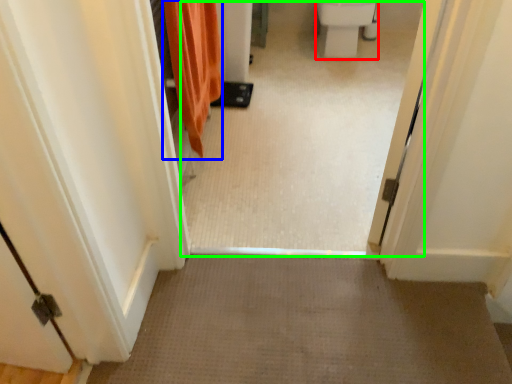
Question: Based on their relative distances, which object is nearer to toilet bowl (highlighted by a red box)? Choose from shower curtain (highlighted by a blue box) and passage (highlighted by a green box).

Choices:
 (A) shower curtain
 (B) passage

Answer: (B)